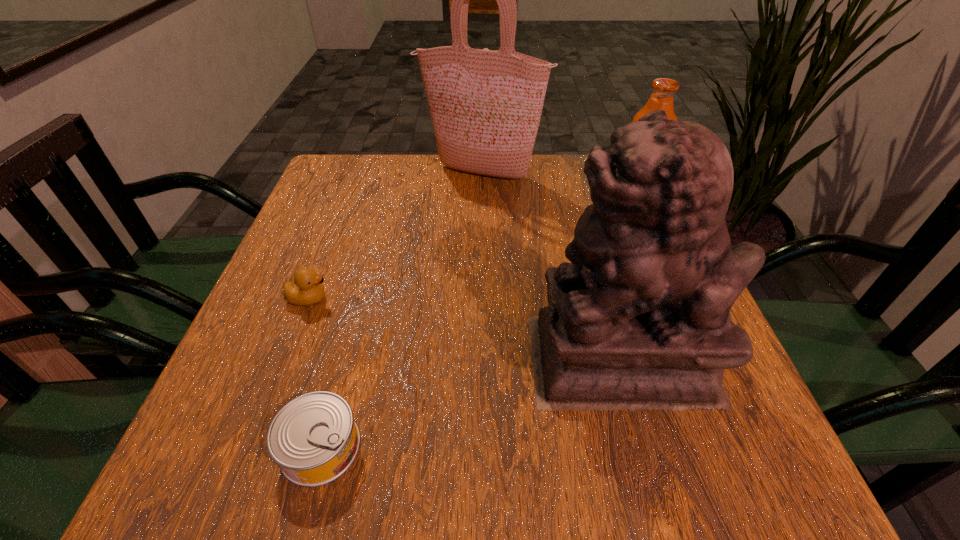
I want to click on vacant space at the far left corner of the desktop, so point(365,180).

Where is `vacant area at the near right corner`? This screenshot has height=540, width=960. vacant area at the near right corner is located at coordinates (664, 460).

At what (x,y) coordinates should I click in order to perform the action: click on free space between the sculpture and the shopping bag. Please return your answer as a coordinate pair (x, y). Looking at the image, I should click on (551, 266).

You are a GUI agent. You are given a task and a screenshot of the screen. Output one action in this format:
    pyautogui.click(x=<x>, y=<y>)
    Task: Click on the free point between the fourth tallest object and the second farthest object
    This screenshot has height=540, width=960.
    Given the screenshot: What is the action you would take?
    pyautogui.click(x=470, y=251)

Where is `free space between the shopping bag and the second shortest object`? The image size is (960, 540). free space between the shopping bag and the second shortest object is located at coordinates (395, 236).

Image resolution: width=960 pixels, height=540 pixels. Find the location of `vacant space that is in between the shortest object and the third tallest object`. vacant space that is in between the shortest object and the third tallest object is located at coordinates (477, 325).

You are a GUI agent. You are given a task and a screenshot of the screen. Output one action in this format:
    pyautogui.click(x=<x>, y=<y>)
    Task: Click on the vacant point located between the fourth tallest object and the farthest object
    The width and height of the screenshot is (960, 540).
    Given the screenshot: What is the action you would take?
    pyautogui.click(x=395, y=236)

The height and width of the screenshot is (540, 960). I want to click on empty space that is in between the second shortest object and the sculpture, so click(x=465, y=329).

Locate an element on the screen. vacant space in between the farthest object and the fruit juice is located at coordinates (557, 188).

You are a GUI agent. You are given a task and a screenshot of the screen. Output one action in this format:
    pyautogui.click(x=<x>, y=<y>)
    Task: Click on the free space that is in between the can and the fourth nearest object
    
    Given the screenshot: What is the action you would take?
    pyautogui.click(x=477, y=325)